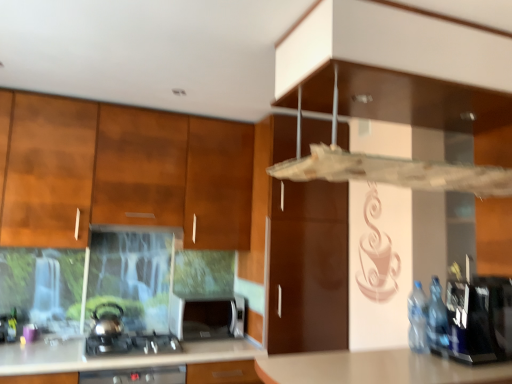
Question: Could you tell me if transparent plastic vent at upper center is facing wooden cabinet at left?

Choices:
 (A) no
 (B) yes

Answer: (A)

Question: From the image's perspective, does transparent plastic vent at upper center appear lower than wooden cabinet at left?

Choices:
 (A) yes
 (B) no

Answer: (B)

Question: Is the depth of transparent plastic vent at upper center greater than that of wooden cabinet at left?

Choices:
 (A) no
 (B) yes

Answer: (A)

Question: Is transparent plastic vent at upper center outside of wooden cabinet at left?

Choices:
 (A) no
 (B) yes

Answer: (B)

Question: Is transparent plastic vent at upper center wider than wooden cabinet at left?

Choices:
 (A) yes
 (B) no

Answer: (A)

Question: In the image, is blue plastic bottles at right on the left side or the right side of satin silver kettle at lower left?

Choices:
 (A) right
 (B) left

Answer: (A)

Question: From a real-world perspective, is blue plastic bottles at right physically located above or below satin silver kettle at lower left?

Choices:
 (A) below
 (B) above

Answer: (B)

Question: Looking at the image, does blue plastic bottles at right seem bigger or smaller compared to satin silver kettle at lower left?

Choices:
 (A) big
 (B) small

Answer: (A)

Question: From the image's perspective, is blue plastic bottles at right located above or below satin silver kettle at lower left?

Choices:
 (A) above
 (B) below

Answer: (A)

Question: Looking at the image, does blue plastic bottles at right seem bigger or smaller compared to satin silver toaster at lower center?

Choices:
 (A) big
 (B) small

Answer: (A)

Question: Considering the positions of point (461, 294) and point (186, 316), is point (461, 294) closer or farther from the camera than point (186, 316)?

Choices:
 (A) farther
 (B) closer

Answer: (B)

Question: In the image, is blue plastic bottles at right positioned in front of or behind satin silver toaster at lower center?

Choices:
 (A) front
 (B) behind

Answer: (A)

Question: From the image's perspective, relative to satin silver toaster at lower center, is blue plastic bottles at right above or below?

Choices:
 (A) above
 (B) below

Answer: (A)

Question: In terms of size, does satin black gas stove at lower left appear bigger or smaller than wooden cabinet at left?

Choices:
 (A) big
 (B) small

Answer: (B)

Question: From the image's perspective, is satin black gas stove at lower left above or below wooden cabinet at left?

Choices:
 (A) above
 (B) below

Answer: (B)